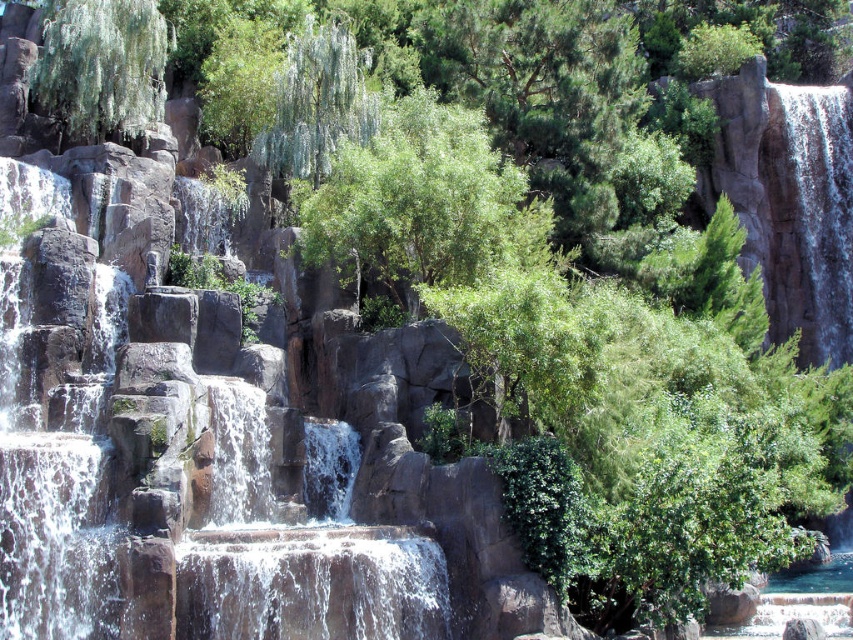
In the scene shown: You are standing at the point labeled as point (x=416, y=202) in the image. What can you see directly in front of you?

You can see a green leafy tree at center directly in front of you at point (x=416, y=202).

You are planning to set up a picnic area near the waterfall. You have a choice between placing it under the white textured water at upper right or near the green leafy tree at upper left. Based on the image, which location would be more sheltered from the waterfall spray?

The green leafy tree at upper left would be more sheltered from the waterfall spray because the white textured water at upper right is positioned under it, meaning the tree is above and could block the spray.